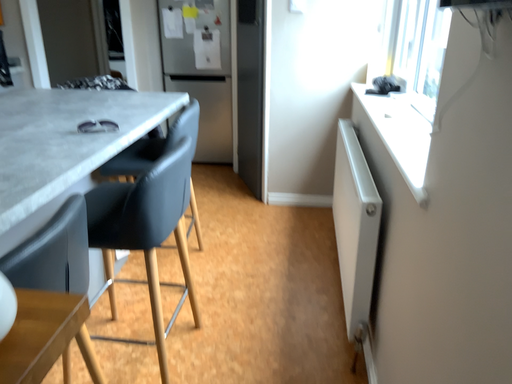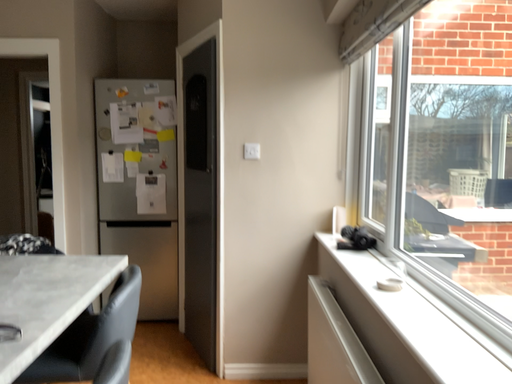
Question: How did the camera likely rotate when shooting the video?

Choices:
 (A) rotated right
 (B) rotated left

Answer: (A)